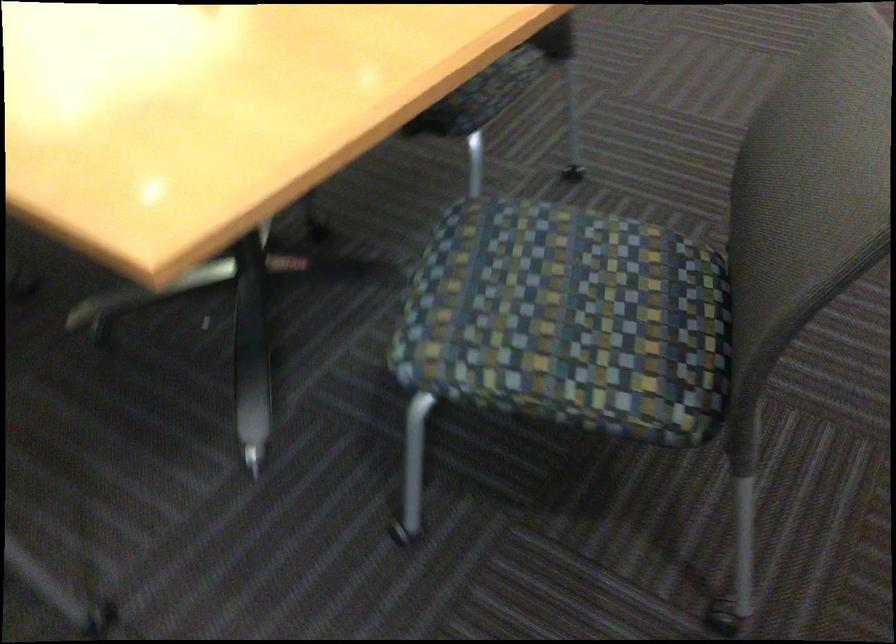
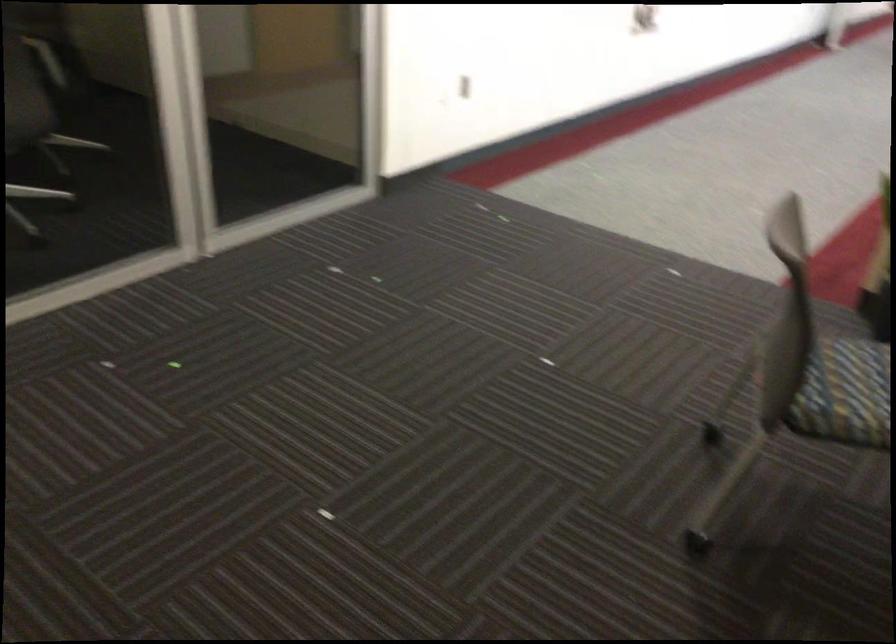
Locate, in the second image, the point that corresponds to pixel 648 277 in the first image.

(845, 393)